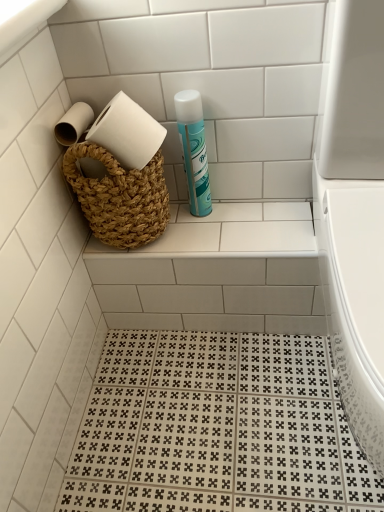
Question: Can you confirm if teal matte cleaning product at upper center is thinner than natural woven basket at upper center?

Choices:
 (A) no
 (B) yes

Answer: (B)

Question: Does teal matte cleaning product at upper center have a greater width compared to natural woven basket at upper center?

Choices:
 (A) no
 (B) yes

Answer: (A)

Question: Does teal matte cleaning product at upper center contain natural woven basket at upper center?

Choices:
 (A) yes
 (B) no

Answer: (B)

Question: Is teal matte cleaning product at upper center oriented towards natural woven basket at upper center?

Choices:
 (A) yes
 (B) no

Answer: (A)

Question: From a real-world perspective, is teal matte cleaning product at upper center on top of natural woven basket at upper center?

Choices:
 (A) no
 (B) yes

Answer: (B)

Question: From the image's perspective, does teal matte cleaning product at upper center appear higher than natural woven basket at upper center?

Choices:
 (A) no
 (B) yes

Answer: (B)

Question: Can you confirm if natural woven basket at upper center is thinner than teal matte cleaning product at upper center?

Choices:
 (A) yes
 (B) no

Answer: (B)

Question: Is natural woven basket at upper center with teal matte cleaning product at upper center?

Choices:
 (A) no
 (B) yes

Answer: (A)

Question: Considering the relative positions of natural woven basket at upper center and teal matte cleaning product at upper center in the image provided, is natural woven basket at upper center in front of teal matte cleaning product at upper center?

Choices:
 (A) yes
 (B) no

Answer: (B)

Question: Can you confirm if natural woven basket at upper center is positioned to the left of teal matte cleaning product at upper center?

Choices:
 (A) yes
 (B) no

Answer: (A)

Question: Is natural woven basket at upper center located outside teal matte cleaning product at upper center?

Choices:
 (A) yes
 (B) no

Answer: (A)

Question: Can you confirm if natural woven basket at upper center is taller than teal matte cleaning product at upper center?

Choices:
 (A) yes
 (B) no

Answer: (B)

Question: From the image's perspective, does white glossy toilet at right appear higher than natural woven basket at upper center?

Choices:
 (A) no
 (B) yes

Answer: (A)